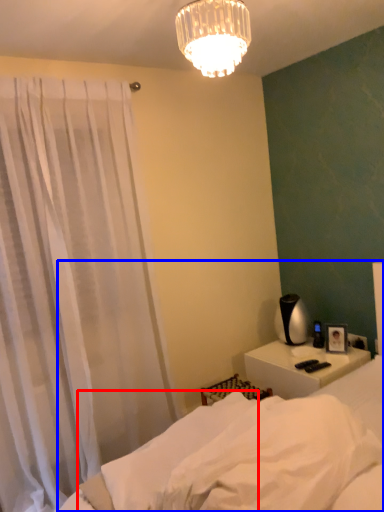
Question: Which point is further to the camera, sheet (highlighted by a red box) or bed (highlighted by a blue box)?

Choices:
 (A) sheet
 (B) bed

Answer: (A)